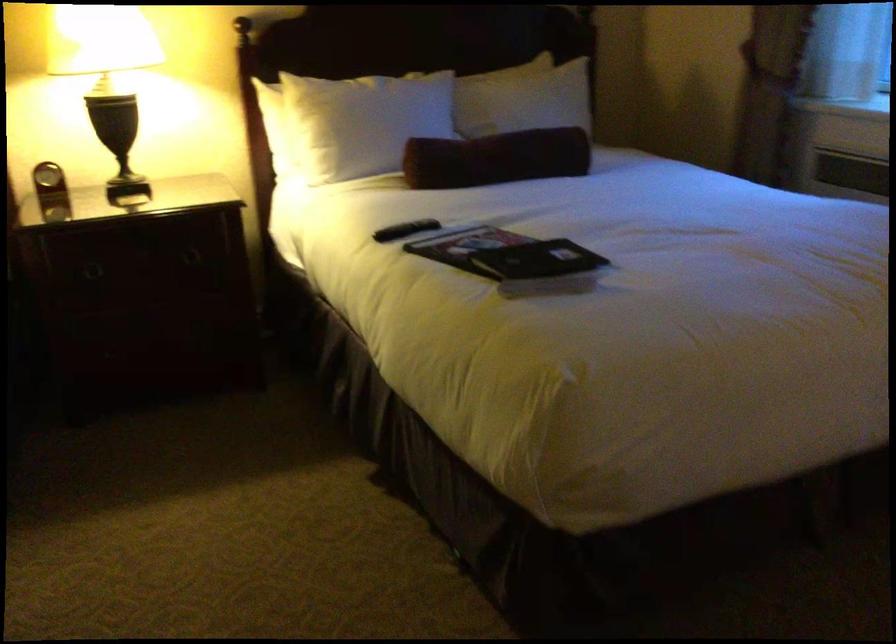
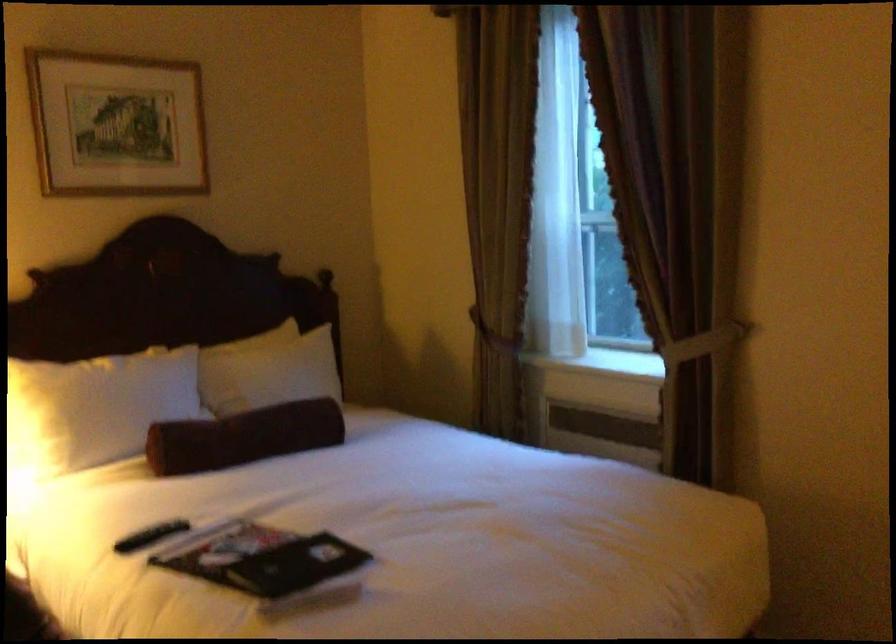
Where in the second image is the point corresponding to point (523, 100) from the first image?

(274, 371)